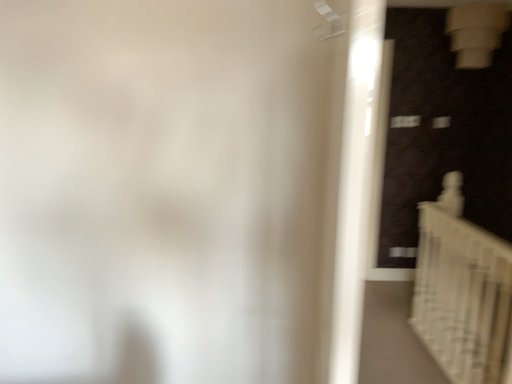
Find the location of a particular element. The width and height of the screenshot is (512, 384). white glossy door at right is located at coordinates (354, 184).

Describe the element at coordinates (354, 184) in the screenshot. The width and height of the screenshot is (512, 384). I see `white glossy door at right` at that location.

This screenshot has height=384, width=512. What do you see at coordinates (463, 297) in the screenshot?
I see `white glossy staircase at lower right` at bounding box center [463, 297].

In order to face white glossy staircase at lower right, should I rotate leftwards or rightwards?

Rotate right and turn 25.320 degrees.

Identify the location of white glossy staircase at lower right. The height and width of the screenshot is (384, 512). point(463,297).

At what (x,y) coordinates should I click in order to perform the action: click on white glossy door at right. Please return your answer as a coordinate pair (x, y). The height and width of the screenshot is (384, 512). Looking at the image, I should click on (354, 184).

Consider the image. Considering the positions of objects white glossy door at right and white glossy staircase at lower right in the image provided, who is more to the left, white glossy door at right or white glossy staircase at lower right?

white glossy door at right is more to the left.

Considering their positions, is white glossy door at right located in front of or behind white glossy staircase at lower right?

In the image, white glossy door at right appears in front of white glossy staircase at lower right.

Is point (362, 188) closer or farther from the camera than point (508, 307)?

Point (362, 188) appears to be closer to the viewer than point (508, 307).

From the image's perspective, who appears lower, white glossy door at right or white glossy staircase at lower right?

From the image's view, white glossy staircase at lower right is below.

From the picture: From a real-world perspective, which is physically above, white glossy door at right or white glossy staircase at lower right?

In real-world perspective, white glossy door at right is above.

Which of these two, white glossy door at right or white glossy staircase at lower right, is wider?

With larger width is white glossy door at right.

From their relative heights in the image, would you say white glossy door at right is taller or shorter than white glossy staircase at lower right?

white glossy door at right is taller than white glossy staircase at lower right.

Is white glossy door at right bigger or smaller than white glossy staircase at lower right?

In the image, white glossy door at right appears to be larger than white glossy staircase at lower right.

Is white glossy staircase at lower right inside white glossy door at right?

That's incorrect, white glossy staircase at lower right is not inside white glossy door at right.

Is white glossy door at right far away from white glossy staircase at lower right?

Yes, white glossy door at right and white glossy staircase at lower right are located far from each other.

Could you tell me if white glossy door at right is turned towards white glossy staircase at lower right?

No.

Locate an element on the screen. stairs lying behind the white glossy door at right is located at coordinates (463, 297).

Does white glossy staircase at lower right appear on the left side of white glossy door at right?

No.

In the image, is white glossy staircase at lower right positioned in front of or behind white glossy door at right?

Clearly, white glossy staircase at lower right is behind white glossy door at right.

Which is in front, point (451, 351) or point (385, 0)?

The point (385, 0) is in front.

From the image's perspective, which object appears higher, white glossy staircase at lower right or white glossy door at right?

From the image's view, white glossy door at right is above.

In the scene shown: From a real-world perspective, is white glossy staircase at lower right positioned above or below white glossy door at right?

white glossy staircase at lower right is situated lower than white glossy door at right in the real world.

Which of these two, white glossy staircase at lower right or white glossy door at right, is wider?

white glossy door at right.

From the picture: Does white glossy staircase at lower right have a greater height compared to white glossy door at right?

Incorrect, the height of white glossy staircase at lower right is not larger of that of white glossy door at right.

Considering the sizes of white glossy staircase at lower right and white glossy door at right in the image, is white glossy staircase at lower right bigger or smaller than white glossy door at right?

Considering their sizes, white glossy staircase at lower right takes up less space than white glossy door at right.

Is white glossy door at right a part of white glossy staircase at lower right?

No, white glossy door at right is not a part of white glossy staircase at lower right.

Is white glossy staircase at lower right directly adjacent to white glossy door at right?

No, white glossy staircase at lower right is not beside white glossy door at right.

Is white glossy staircase at lower right turned away from white glossy door at right?

No, white glossy staircase at lower right is not facing away from white glossy door at right.

Where is `door in front of the white glossy staircase at lower right`? This screenshot has width=512, height=384. door in front of the white glossy staircase at lower right is located at coordinates [354, 184].

The height and width of the screenshot is (384, 512). In order to click on door in front of the white glossy staircase at lower right in this screenshot , I will do `click(354, 184)`.

This screenshot has width=512, height=384. I want to click on stairs located behind the white glossy door at right, so click(x=463, y=297).